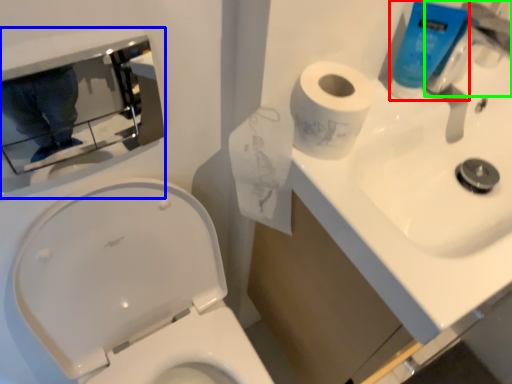
Question: Estimate the real-world distances between objects in this image. Which object is closer to cleaning product (highlighted by a red box), medicine cabinet (highlighted by a blue box) or faucet (highlighted by a green box)?

Choices:
 (A) medicine cabinet
 (B) faucet

Answer: (B)